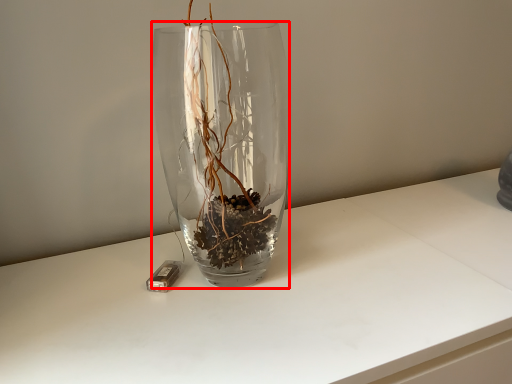
Question: From the image's perspective, where is vase (annotated by the red box) located in relation to candle holder in the image?

Choices:
 (A) above
 (B) below

Answer: (A)